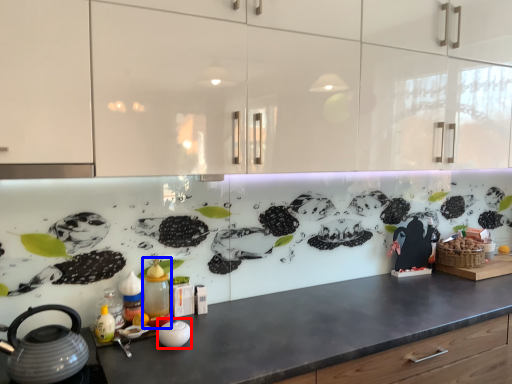
Question: Which of the following is the closest to the observer, appliance (highlighted by a red box) or bottle (highlighted by a blue box)?

Choices:
 (A) appliance
 (B) bottle

Answer: (A)